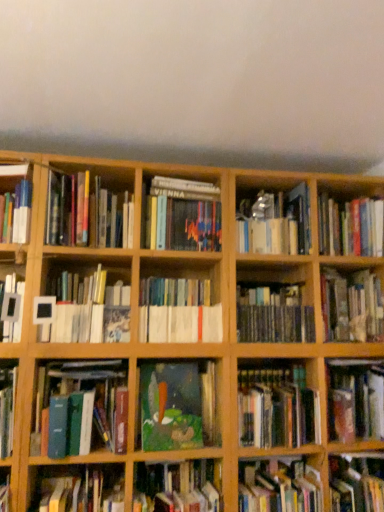
Question: Is hardcover book at center, placed as the sixteenth book when sorted from left to right, inside the boundaries of hardcover books at center, the twelfth book when ordered from right to left, or outside?

Choices:
 (A) outside
 (B) inside

Answer: (A)

Question: Visually, is hardcover book at center, positioned as the second book in right-to-left order, positioned to the left or to the right of hardcover books at center, positioned as the 6th book in left-to-right order?

Choices:
 (A) left
 (B) right

Answer: (B)

Question: Based on their relative distances, which object is nearer to the hardcover book at center, acting as the fifth book starting from the right?

Choices:
 (A) white matte picture frame at center-left, the 16th book when ordered from right to left
 (B) hardcover book at center, the 7th book from the left
 (C) oil painting at center, arranged as the 8th book when viewed from the left
 (D) hardcover books at center, the twelfth book when ordered from right to left
 (E) hardcover books at center, the 10th book viewed from the left

Answer: (C)

Question: Which object is positioned closest to the hardcover book at lower right, the sixth book when ordered from right to left?

Choices:
 (A) hardcover books at center, the 10th book viewed from the left
 (B) hardcover book at upper left, the 13th book in the right-to-left sequence
 (C) hardcover book at center, which ranks as the 11th book in right-to-left order
 (D) metallic silver book at center, which is counted as the seventh book, starting from the right
 (E) hardcover book at lower left, positioned as the 14th book in right-to-left order

Answer: (C)